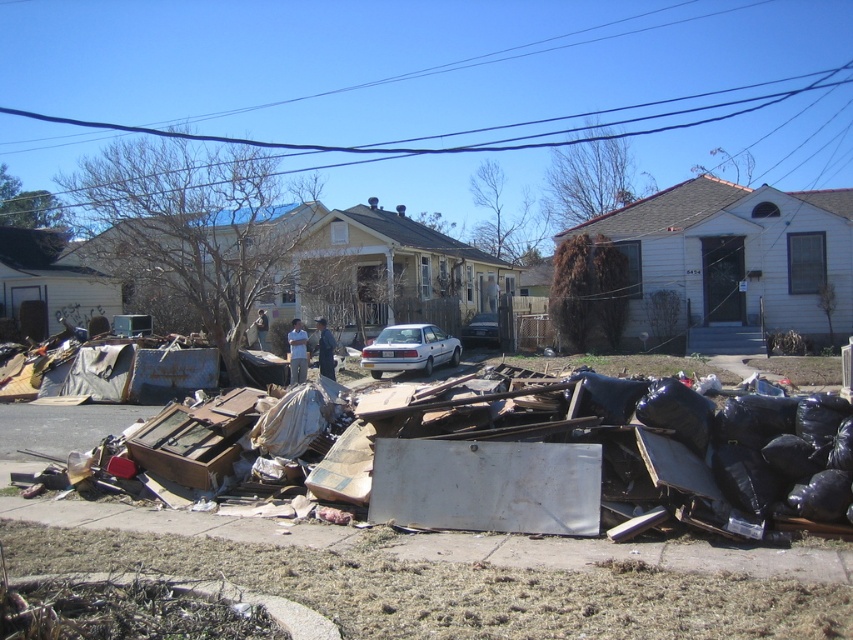
Question: Which is farther from the silver metallic sedan at center?

Choices:
 (A) white matte car at center
 (B) black wire at upper center

Answer: (B)

Question: Can you confirm if rusty cardboard boxes at lower center is positioned to the left of white matte car at center?

Choices:
 (A) yes
 (B) no

Answer: (A)

Question: In this image, where is black wire at upper center located relative to white matte car at center?

Choices:
 (A) below
 (B) above

Answer: (B)

Question: Can you confirm if rusty cardboard boxes at lower center is positioned to the left of white matte car at center?

Choices:
 (A) yes
 (B) no

Answer: (A)

Question: Estimate the real-world distances between objects in this image. Which object is closer to the black wire at upper center?

Choices:
 (A) white matte car at center
 (B) rusty cardboard boxes at lower center
 (C) silver metallic sedan at center

Answer: (C)

Question: Which object is farther from the camera taking this photo?

Choices:
 (A) black wire at upper center
 (B) white matte car at center

Answer: (A)